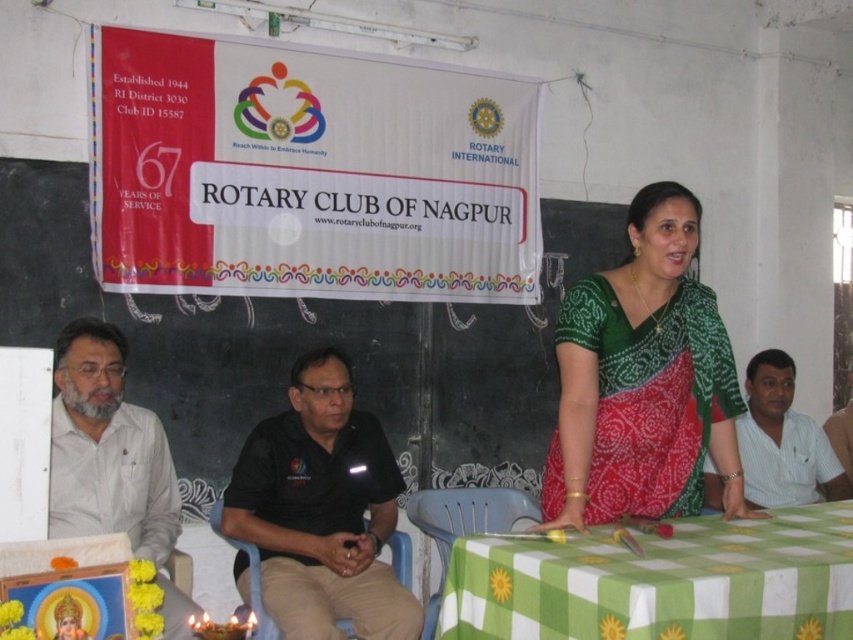
Which is more to the right, beige cotton shirt at left or white cotton shirt at center?

white cotton shirt at center is more to the right.

Does point (163, 429) lie behind point (833, 490)?

No.

Is point (65, 481) positioned behind point (799, 438)?

No, it is not.

Image resolution: width=853 pixels, height=640 pixels. What are the coordinates of `beige cotton shirt at left` in the screenshot? It's located at (107, 449).

The image size is (853, 640). Describe the element at coordinates (107, 449) in the screenshot. I see `beige cotton shirt at left` at that location.

Who is more forward, [148,468] or [846,452]?

Point [148,468] is more forward.

Is point (120, 509) farther from camera compared to point (836, 422)?

No, (120, 509) is closer to viewer.

You are a GUI agent. You are given a task and a screenshot of the screen. Output one action in this format:
    pyautogui.click(x=<x>, y=<y>)
    Task: Click on the beige cotton shirt at left
    
    Given the screenshot: What is the action you would take?
    pyautogui.click(x=107, y=449)

Is point (816, 445) in front of point (848, 368)?

Yes, point (816, 445) is closer to viewer.

Is point (798, 428) more distant than point (850, 426)?

No, it is in front of (850, 426).

Identify the location of white cotton shirt at center. The image size is (853, 640). pyautogui.click(x=782, y=442).